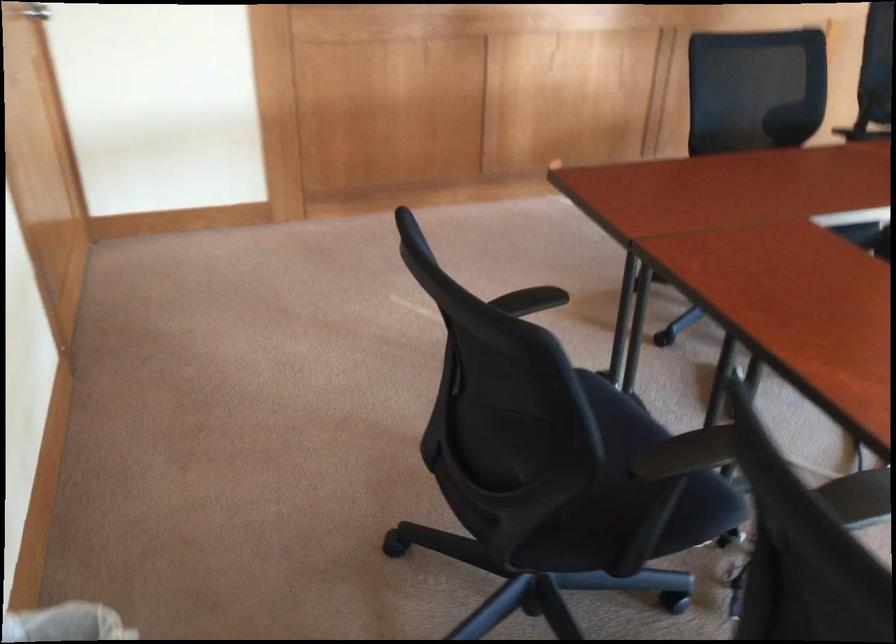
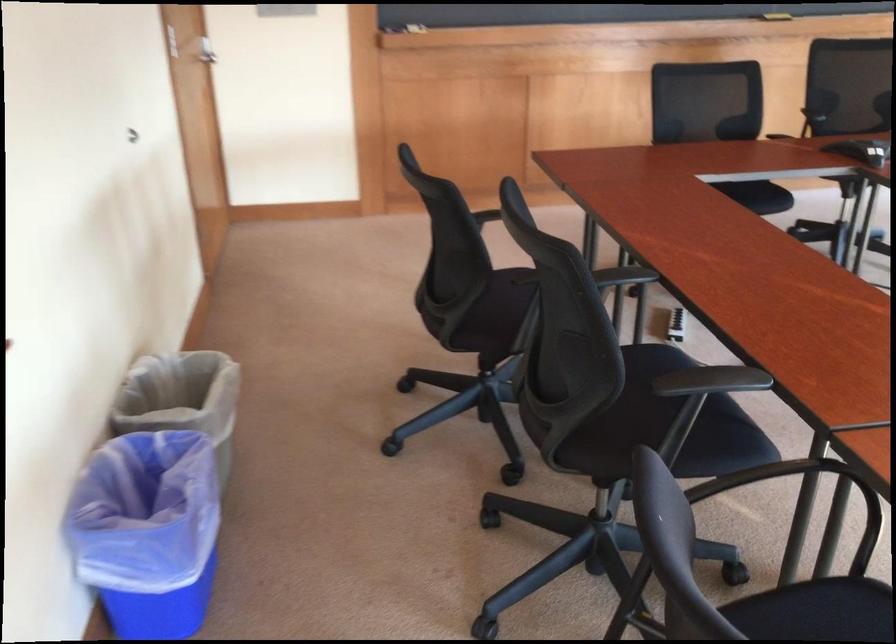
Question: I am providing you with two images of the same scene from different viewpoints. Please identify which objects are invisible in image2.

Choices:
 (A) silver door handle
 (B) blue trash can
 (C) grey trash can
 (D) none of these

Answer: (D)